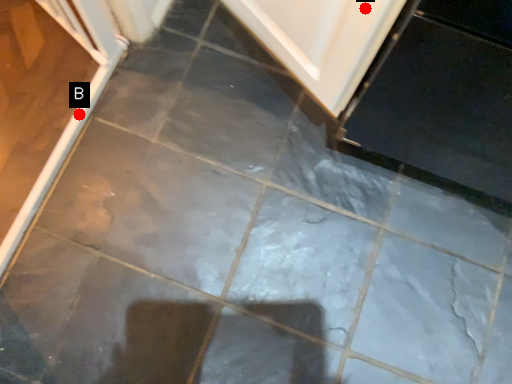
Question: Two points are circled on the image, labeled by A and B beside each circle. Which point appears closest to the camera in this image?

Choices:
 (A) A is closer
 (B) B is closer

Answer: (A)